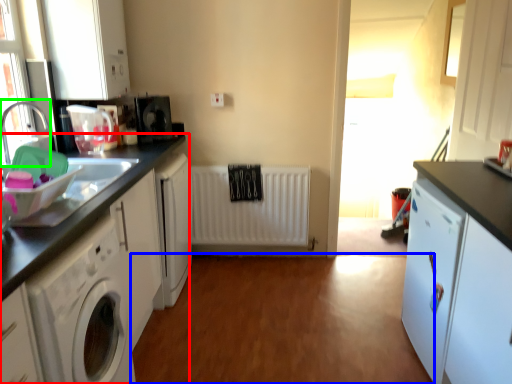
Question: Considering the real-world distances, which object is farthest from cabinetry (highlighted by a red box)? plain (highlighted by a blue box) or faucet (highlighted by a green box)?

Choices:
 (A) plain
 (B) faucet

Answer: (A)